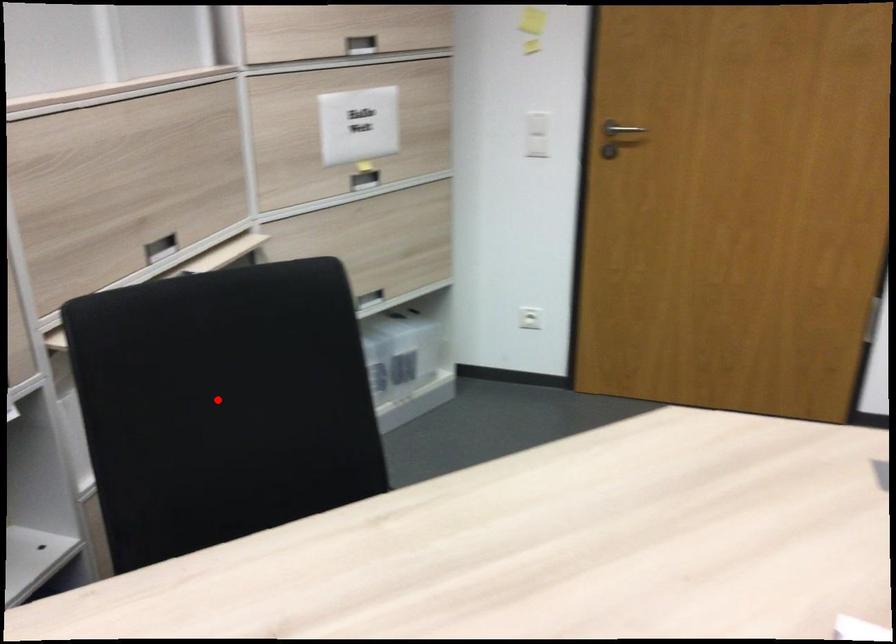
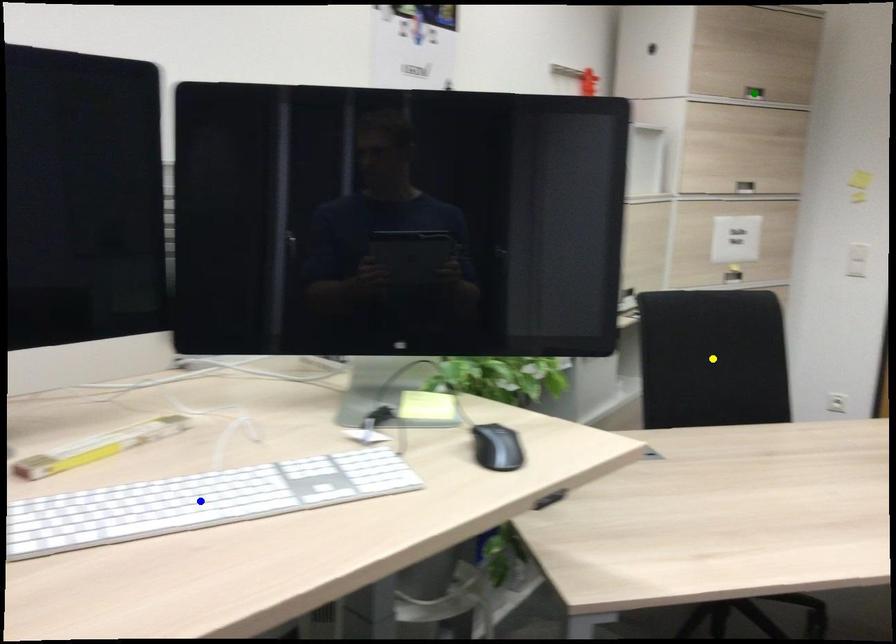
Question: I am providing you with two images of the same scene from different viewpoints. A red point is marked on the first image. You are given multiple points on the second image. Which point in image 2 represents the same 3d spot as the red point in image 1?

Choices:
 (A) blue point
 (B) green point
 (C) yellow point

Answer: (C)